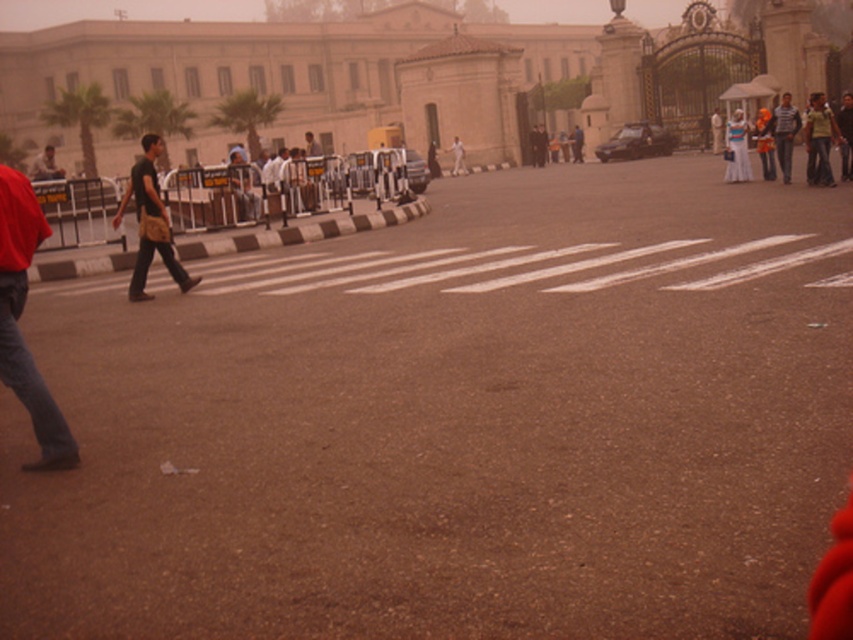
Question: Observing the image, what is the correct spatial positioning of denim jeans at left in reference to white fabric dress at right?

Choices:
 (A) left
 (B) right

Answer: (A)

Question: Among these points, which one is nearest to the camera?

Choices:
 (A) tap(737, 145)
 (B) tap(460, 161)

Answer: (A)

Question: Which point appears farthest from the camera in this image?

Choices:
 (A) (456, 140)
 (B) (819, 140)
 (C) (816, 108)
 (D) (50, 449)

Answer: (A)

Question: Does denim jeans at left appear under matte black helmet at center?

Choices:
 (A) no
 (B) yes

Answer: (B)

Question: Does denim jeans at left have a larger size compared to orange fabric bag at center-right?

Choices:
 (A) yes
 (B) no

Answer: (B)

Question: Which object appears farthest from the camera in this image?

Choices:
 (A) striped shirt at center
 (B) light brown leather jacket at center
 (C) denim jeans at left

Answer: (B)